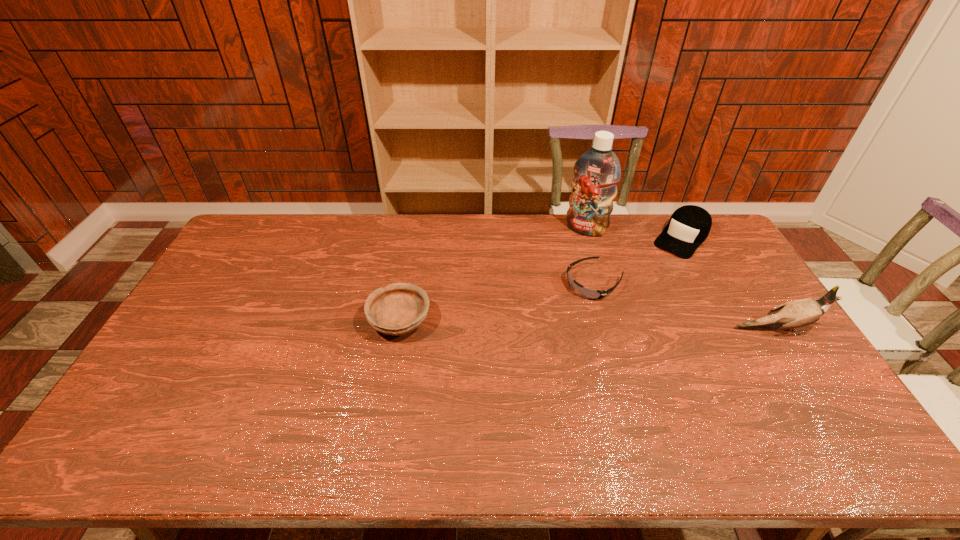
Locate an element on the screen. The image size is (960, 540). vacant position located 0.250m on the front label of the shampoo is located at coordinates (556, 276).

The height and width of the screenshot is (540, 960). I want to click on vacant space located 0.160m on the front label of the shampoo, so click(564, 261).

Find the location of a particular element. This screenshot has width=960, height=540. blank area located on the front label of the shampoo is located at coordinates (543, 299).

What are the coordinates of `blank area located 0.350m on the front-facing side of the third tallest object` in the screenshot? It's located at (622, 307).

Image resolution: width=960 pixels, height=540 pixels. I want to click on vacant space located on the front-facing side of the third tallest object, so click(x=620, y=309).

Where is `vacant space positioned on the front-facing side of the third tallest object`? Image resolution: width=960 pixels, height=540 pixels. vacant space positioned on the front-facing side of the third tallest object is located at coordinates (650, 275).

Identify the location of shampoo that is at the far edge. This screenshot has height=540, width=960. (597, 171).

You are a GUI agent. You are given a task and a screenshot of the screen. Output one action in this format:
    pyautogui.click(x=<x>, y=<y>)
    Task: Click on the cap at the far edge
    Image resolution: width=960 pixels, height=540 pixels.
    Given the screenshot: What is the action you would take?
    pyautogui.click(x=689, y=226)

You are a GUI agent. You are given a task and a screenshot of the screen. Output one action in this format:
    pyautogui.click(x=<x>, y=<y>)
    Task: Click on the bird that is at the right edge
    
    Given the screenshot: What is the action you would take?
    pyautogui.click(x=798, y=313)

I want to click on cap positioned at the right edge, so click(x=689, y=226).